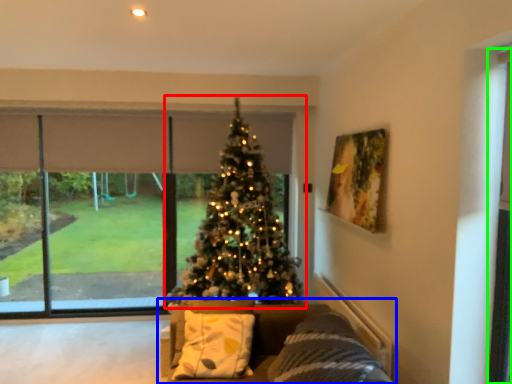
Question: Based on their relative distances, which object is farther from christmas tree (highlighted by a red box)? Choose from studio couch (highlighted by a blue box) and screen door (highlighted by a green box).

Choices:
 (A) studio couch
 (B) screen door

Answer: (B)